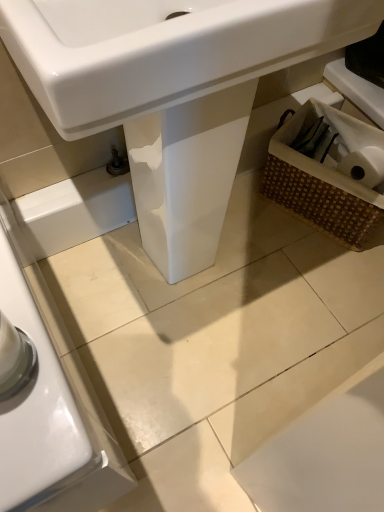
Locate an element on the screen. free space that is in between white glossy sink at center and woven brown basket at lower right is located at coordinates (289, 248).